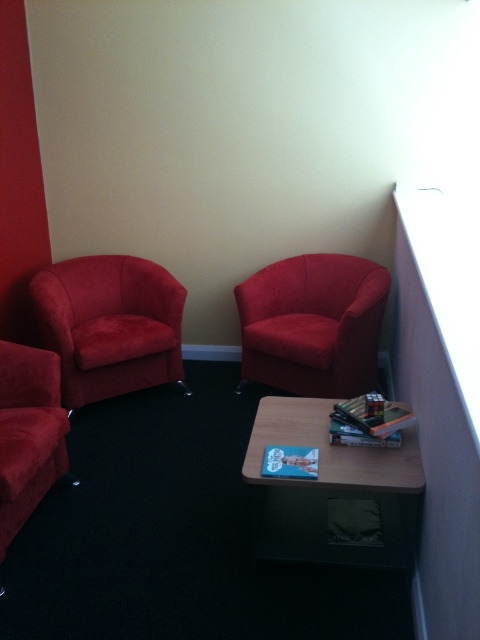
You are standing in the cozy corner of the room with two points marked on the floor. The first point is at coordinate point(404, 486) and the second point is at coordinate point(96, 358). Which point is closer to you?

Point(404, 486) is in front of point(96, 358), so it is closer to you.

You are sitting in the velvet red armchair at left and want to move to the matte red couch at left. Which direction should you move to reach it?

The velvet red armchair at left is to the right of the matte red couch at left, so you should move to the left to reach the matte red couch at left.

You are sitting on the velvet red armchair at left and want to reach the matte red couch at left. Which direction should you move to get there?

Since the velvet red armchair at left is taller than the matte red couch at left, you should move downward to reach the matte red couch at left from the velvet red armchair at left.